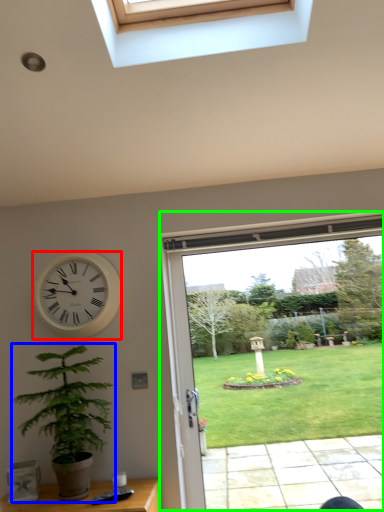
Question: Based on their relative distances, which object is nearer to wall clock (highlighted by a red box)? Choose from houseplant (highlighted by a blue box) and window (highlighted by a green box).

Choices:
 (A) houseplant
 (B) window

Answer: (A)